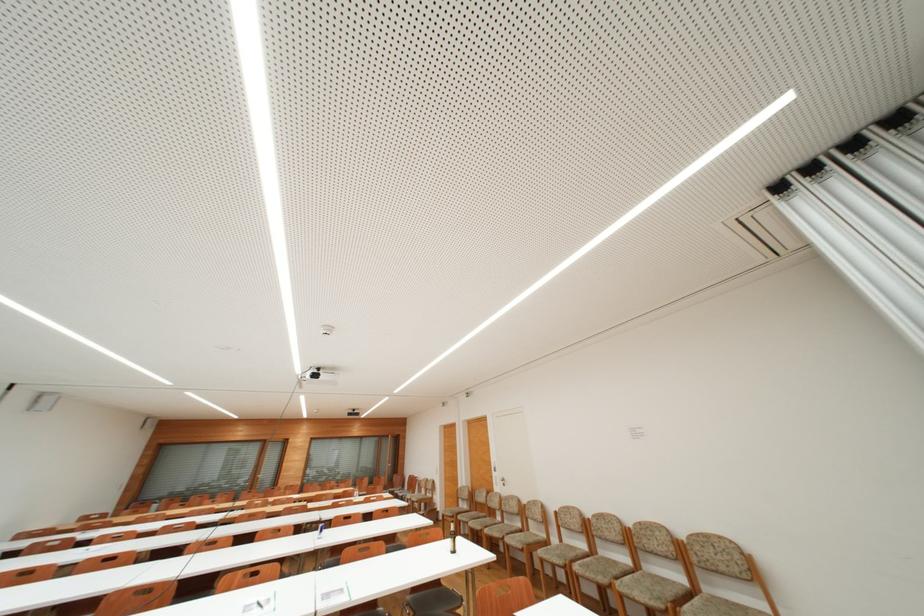
What are the coordinates of `silver door handle` in the screenshot? It's located at (503, 480).